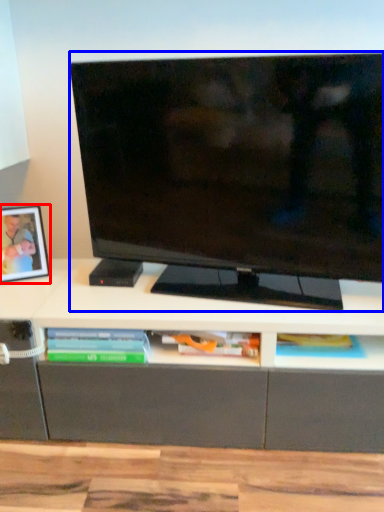
Question: Which of the following is the closest to the observer, picture frame (highlighted by a red box) or television (highlighted by a blue box)?

Choices:
 (A) picture frame
 (B) television

Answer: (B)